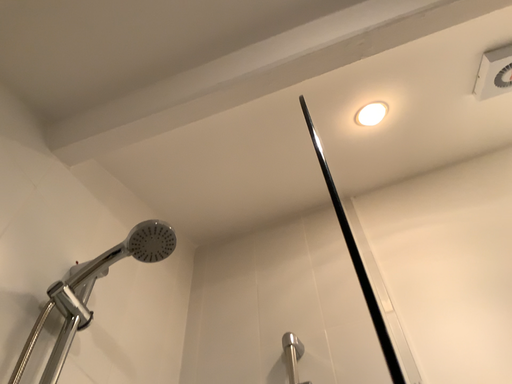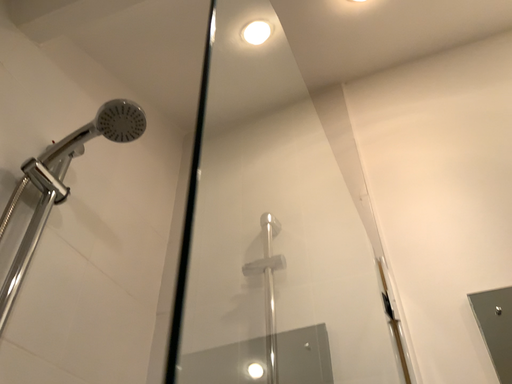
Question: Which way did the camera rotate in the video?

Choices:
 (A) rotated downward
 (B) rotated upward

Answer: (A)